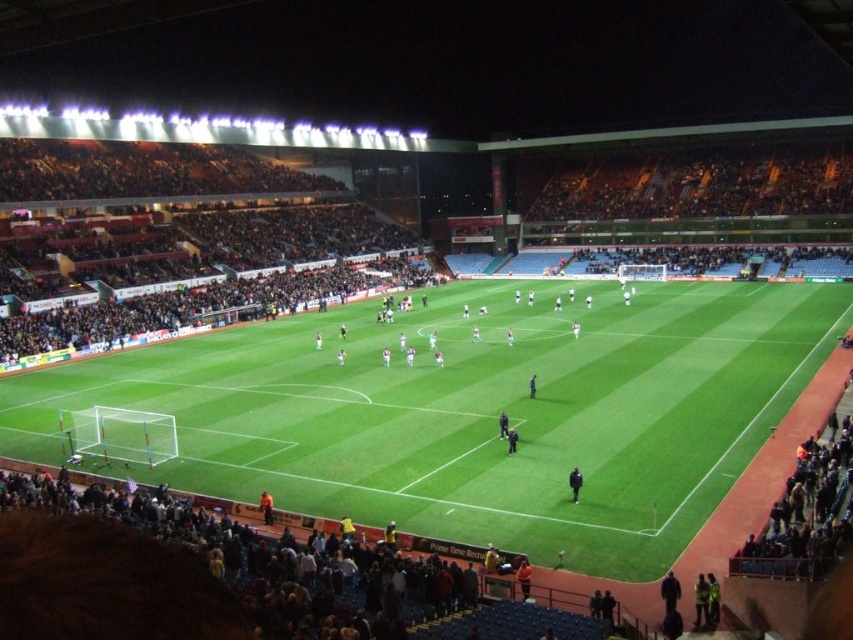
You are a drone operator trying to capture a live football match. Your drone is currently hovering at the stadium entrance, which is located at the bottom edge of the image. You need to fly the drone to the green grass football field at center to get a clear shot. In which general direction should you direct the drone to move from its current position?

The green grass football field at center is located at point (x=474, y=412) in the image. Since the drone is at the bottom edge, it should move upward and slightly to the right to reach the field.

You are a drone operator tasked with capturing aerial footage of the football match. Your drone is currently hovering at point A, which is at coordinates 0.5, 0.5. You need to adjust its position to directly above the green grass football field at center. Which direction should you move the drone to reach the field?

The green grass football field at center is located at point (474, 412), so you should move the drone northeast to reach the field.